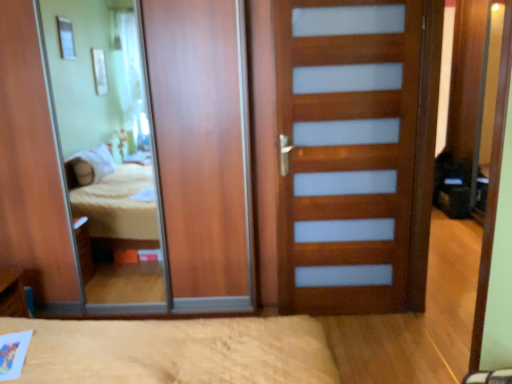
Question: Is blue plastic pen at lower left with wooden door with frosted panels at center?

Choices:
 (A) yes
 (B) no

Answer: (B)

Question: Does blue plastic pen at lower left have a larger size compared to wooden door with frosted panels at center?

Choices:
 (A) no
 (B) yes

Answer: (A)

Question: Is blue plastic pen at lower left not within wooden door with frosted panels at center?

Choices:
 (A) no
 (B) yes

Answer: (B)

Question: Does blue plastic pen at lower left have a lesser width compared to wooden door with frosted panels at center?

Choices:
 (A) no
 (B) yes

Answer: (A)

Question: Is blue plastic pen at lower left further to the viewer compared to wooden door with frosted panels at center?

Choices:
 (A) no
 (B) yes

Answer: (B)

Question: From a real-world perspective, is blue plastic pen at lower left positioned above or below wooden door with frosted panels at center?

Choices:
 (A) below
 (B) above

Answer: (A)

Question: From the image's perspective, is blue plastic pen at lower left located above or below wooden door with frosted panels at center?

Choices:
 (A) above
 (B) below

Answer: (B)

Question: Based on their positions, is blue plastic pen at lower left located to the left or right of wooden door with frosted panels at center?

Choices:
 (A) right
 (B) left

Answer: (B)

Question: Is point (11, 306) closer or farther from the camera than point (298, 9)?

Choices:
 (A) farther
 (B) closer

Answer: (A)

Question: Based on their sizes in the image, would you say wooden mirror at center is bigger or smaller than wooden door with frosted panels at center?

Choices:
 (A) small
 (B) big

Answer: (B)

Question: From a real-world perspective, relative to wooden door with frosted panels at center, is wooden mirror at center vertically above or below?

Choices:
 (A) above
 (B) below

Answer: (A)

Question: In the image, is wooden mirror at center positioned in front of or behind wooden door with frosted panels at center?

Choices:
 (A) front
 (B) behind

Answer: (B)

Question: Is point (42, 34) positioned closer to the camera than point (428, 180)?

Choices:
 (A) closer
 (B) farther

Answer: (A)

Question: Considering the positions of wooden door with frosted panels at center and wooden mirror at center in the image, is wooden door with frosted panels at center taller or shorter than wooden mirror at center?

Choices:
 (A) short
 (B) tall

Answer: (A)

Question: Looking at the image, does wooden door with frosted panels at center seem bigger or smaller compared to wooden mirror at center?

Choices:
 (A) big
 (B) small

Answer: (B)